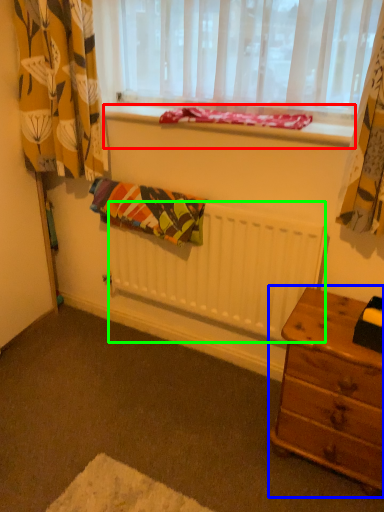
Question: Based on their relative distances, which object is nearer to window sill (highlighted by a red box)? Choose from nightstand (highlighted by a blue box) and radiator (highlighted by a green box).

Choices:
 (A) nightstand
 (B) radiator

Answer: (B)